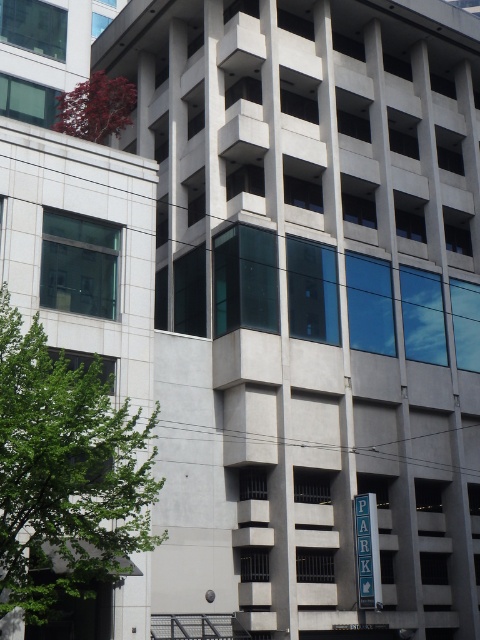
Based on the photo, you are standing in front of the building and notice two points marked on the facade. Which point, point (x=62, y=118) or point (x=357, y=496), is closer to you?

Point (x=62, y=118) is closer to you because it is further to the viewer than point (x=357, y=496).

You are a city planner evaluating the building. Which object, the green leafy tree at left or the blue metal parking sign at center, occupies more space in the image?

The green leafy tree at left has a larger size compared to the blue metal parking sign at center, so it occupies more space in the image.

You are standing at the entrance of the building marked by the sign that says PARK. You see two points in the image, point (x=26, y=440) and point (x=364, y=524). Which point is closer to you?

Point (x=26, y=440) is in front of point (x=364, y=524), so it is closer to you.